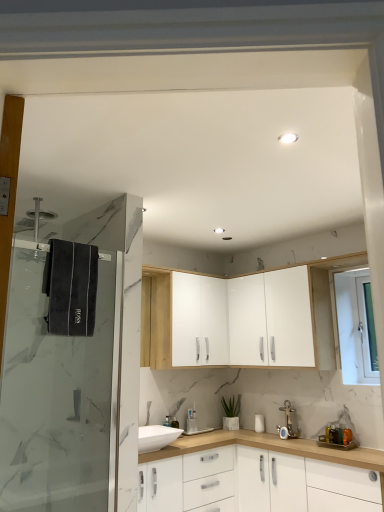
I want to click on free space in front of white glossy light fixture at upper center, so click(x=304, y=116).